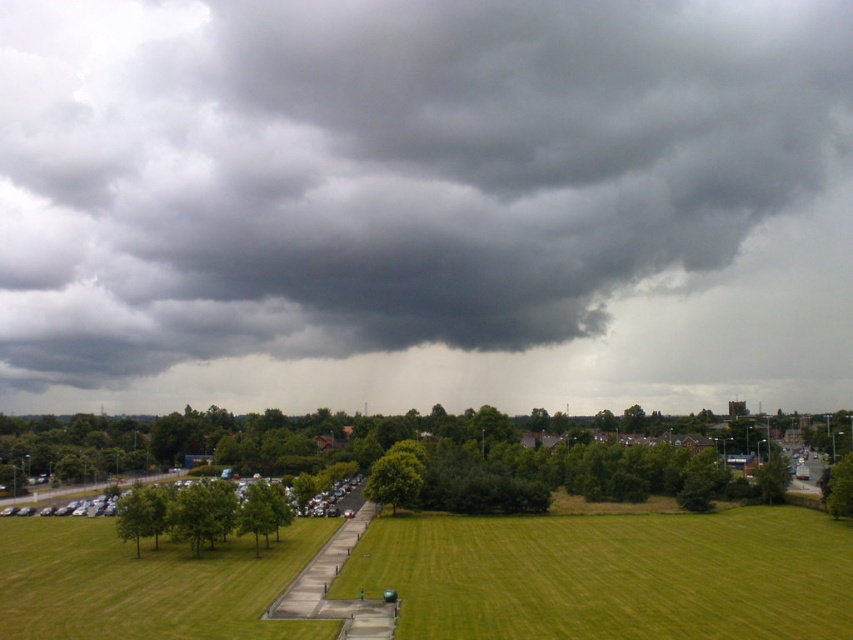
Question: Considering the real-world distances, which object is closest to the green grass at lower left?

Choices:
 (A) green grassy field at center
 (B) dark gray cloud at upper center

Answer: (A)

Question: From the image, what is the correct spatial relationship of dark gray cloud at upper center in relation to green grassy field at center?

Choices:
 (A) below
 (B) above

Answer: (B)

Question: Is green grassy field at center in front of green grass at lower left?

Choices:
 (A) yes
 (B) no

Answer: (A)

Question: Which object is the closest to the green grass at lower left?

Choices:
 (A) dark gray cloud at upper center
 (B) green grassy field at center

Answer: (B)

Question: Which of the following is the farthest from the observer?

Choices:
 (A) (518, 614)
 (B) (779, 241)

Answer: (B)

Question: Can you confirm if dark gray cloud at upper center is thinner than green grassy field at center?

Choices:
 (A) yes
 (B) no

Answer: (B)